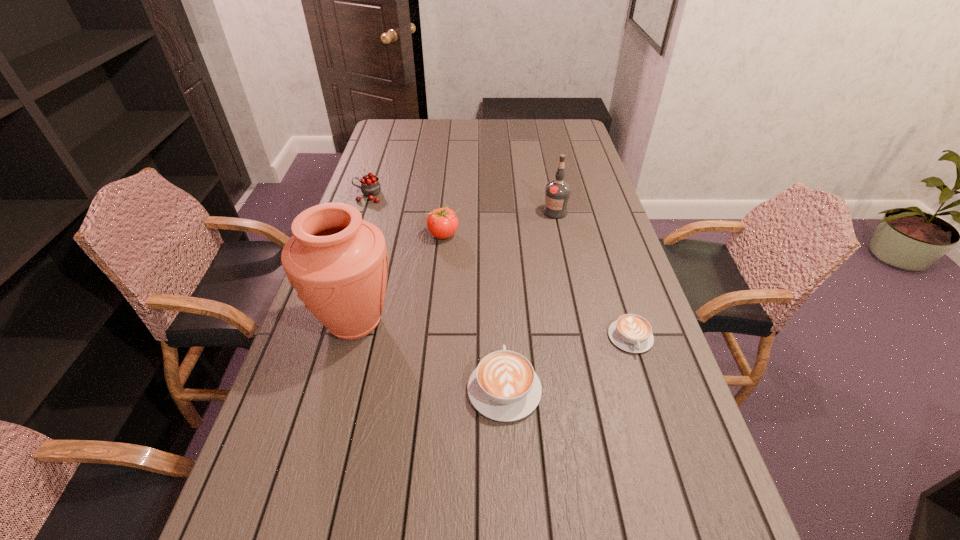
Identify the location of vacant space that is in between the farther cappuccino and the fifth nearest object. The height and width of the screenshot is (540, 960). (593, 275).

Image resolution: width=960 pixels, height=540 pixels. What are the coordinates of `free space between the third farthest object and the right cappuccino` in the screenshot? It's located at (537, 286).

Find the location of a particular element. unoccupied area between the farthest object and the fourth object from right to left is located at coordinates (406, 215).

Identify the location of vacant space that's between the vase and the left cappuccino. (429, 355).

Locate an element on the screen. This screenshot has height=540, width=960. unoccupied position between the rightmost object and the farthest object is located at coordinates [499, 266].

You are a GUI agent. You are given a task and a screenshot of the screen. Output one action in this format:
    pyautogui.click(x=<x>, y=<y>)
    Task: Click on the object that stands as the fifth closest to the third farthest object
    This screenshot has width=960, height=540.
    Given the screenshot: What is the action you would take?
    pyautogui.click(x=632, y=333)

Find the location of `object that is the second closest to the farthest object`. object that is the second closest to the farthest object is located at coordinates (338, 263).